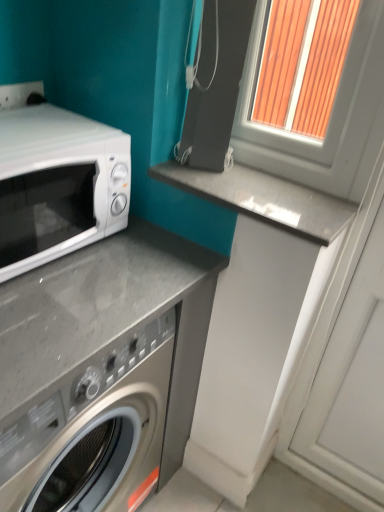
You are a GUI agent. You are given a task and a screenshot of the screen. Output one action in this format:
    pyautogui.click(x=<x>, y=<y>)
    Task: Click on the vacant area that is situated to the right of white glossy microwave at left
    The image size is (384, 512).
    Given the screenshot: What is the action you would take?
    pyautogui.click(x=119, y=274)